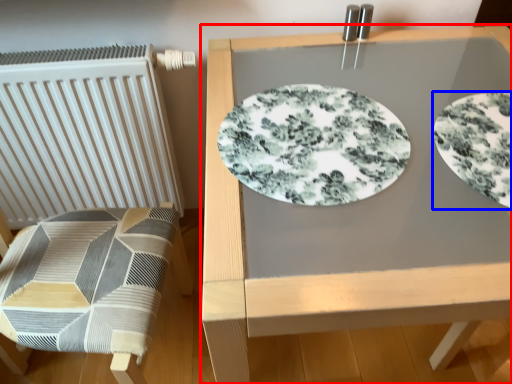
Question: Which of the following is the closest to the observer, table (highlighted by a red box) or plate (highlighted by a blue box)?

Choices:
 (A) table
 (B) plate

Answer: (A)